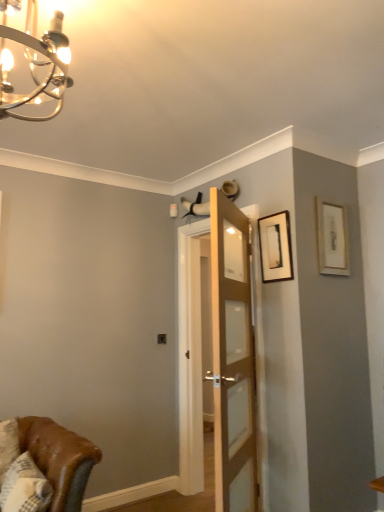
Question: Is matte gold picture frame at upper right, which ranks as the 2th picture frame in left-to-right order, smaller than white textured pillow at lower left?

Choices:
 (A) yes
 (B) no

Answer: (A)

Question: Is matte gold picture frame at upper right, which ranks as the 2th picture frame in left-to-right order, oriented away from white textured pillow at lower left?

Choices:
 (A) no
 (B) yes

Answer: (A)

Question: Considering the relative sizes of matte gold picture frame at upper right, which ranks as the 2th picture frame in left-to-right order, and white textured pillow at lower left in the image provided, is matte gold picture frame at upper right, which ranks as the 2th picture frame in left-to-right order, wider than white textured pillow at lower left?

Choices:
 (A) yes
 (B) no

Answer: (B)

Question: From the image's perspective, is matte gold picture frame at upper right, acting as the first picture frame starting from the right, beneath white textured pillow at lower left?

Choices:
 (A) yes
 (B) no

Answer: (B)

Question: Is matte gold picture frame at upper right, acting as the first picture frame starting from the right, next to white textured pillow at lower left and touching it?

Choices:
 (A) no
 (B) yes

Answer: (A)

Question: Considering the relative positions of matte gold picture frame at upper right, acting as the first picture frame starting from the right, and white textured pillow at lower left in the image provided, is matte gold picture frame at upper right, acting as the first picture frame starting from the right, to the right of white textured pillow at lower left from the viewer's perspective?

Choices:
 (A) no
 (B) yes

Answer: (B)

Question: Does white textured pillow at lower left have a lesser width compared to wooden door at center?

Choices:
 (A) yes
 (B) no

Answer: (B)

Question: Considering the relative sizes of white textured pillow at lower left and wooden door at center in the image provided, is white textured pillow at lower left smaller than wooden door at center?

Choices:
 (A) yes
 (B) no

Answer: (A)

Question: Considering the relative sizes of white textured pillow at lower left and wooden door at center in the image provided, is white textured pillow at lower left bigger than wooden door at center?

Choices:
 (A) no
 (B) yes

Answer: (A)

Question: Is white textured pillow at lower left taller than wooden door at center?

Choices:
 (A) no
 (B) yes

Answer: (A)

Question: From the image's perspective, is white textured pillow at lower left located above wooden door at center?

Choices:
 (A) no
 (B) yes

Answer: (A)

Question: Is white textured pillow at lower left positioned in front of wooden door at center?

Choices:
 (A) no
 (B) yes

Answer: (B)

Question: Is matte black picture frame at upper right, acting as the 2th picture frame starting from the right, in front of chrome/metallic chandelier at upper left?

Choices:
 (A) yes
 (B) no

Answer: (B)